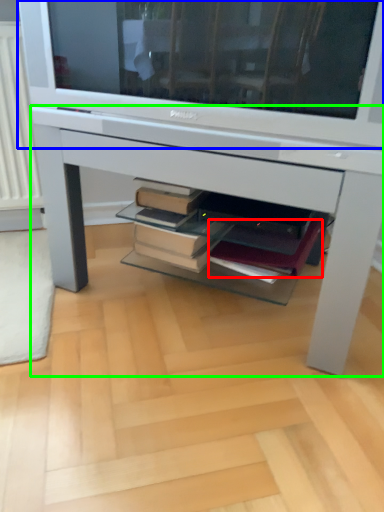
Question: Estimate the real-world distances between objects in this image. Which object is farther from paperback book (highlighted by a red box), television (highlighted by a blue box) or desk (highlighted by a green box)?

Choices:
 (A) television
 (B) desk

Answer: (A)